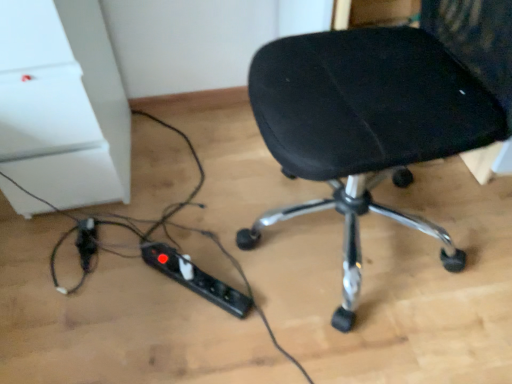
Question: Considering the positions of black plastic extension cord at lower center, acting as the 1th extension cord starting from the right, and black fabric chair at center in the image, is black plastic extension cord at lower center, acting as the 1th extension cord starting from the right, wider or thinner than black fabric chair at center?

Choices:
 (A) thin
 (B) wide

Answer: (A)

Question: Is black plastic extension cord at lower center, the second extension cord when ordered from left to right, inside or outside of black fabric chair at center?

Choices:
 (A) outside
 (B) inside

Answer: (A)

Question: Which object is positioned closest to the black fabric chair at center?

Choices:
 (A) black plastic extension cord at lower left, which appears as the first extension cord when viewed from the left
 (B) black plastic extension cord at lower center, acting as the 1th extension cord starting from the right

Answer: (B)

Question: Which object is positioned farthest from the black plastic extension cord at lower left, which appears as the first extension cord when viewed from the left?

Choices:
 (A) black plastic extension cord at lower center, acting as the 1th extension cord starting from the right
 (B) black fabric chair at center

Answer: (B)